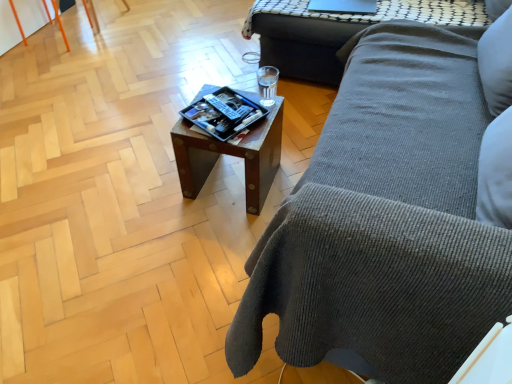
The image size is (512, 384). Identify the location of vacant area situated to the left side of wooden tray at center, positioned as the 2th table in top-to-bottom order. (155, 190).